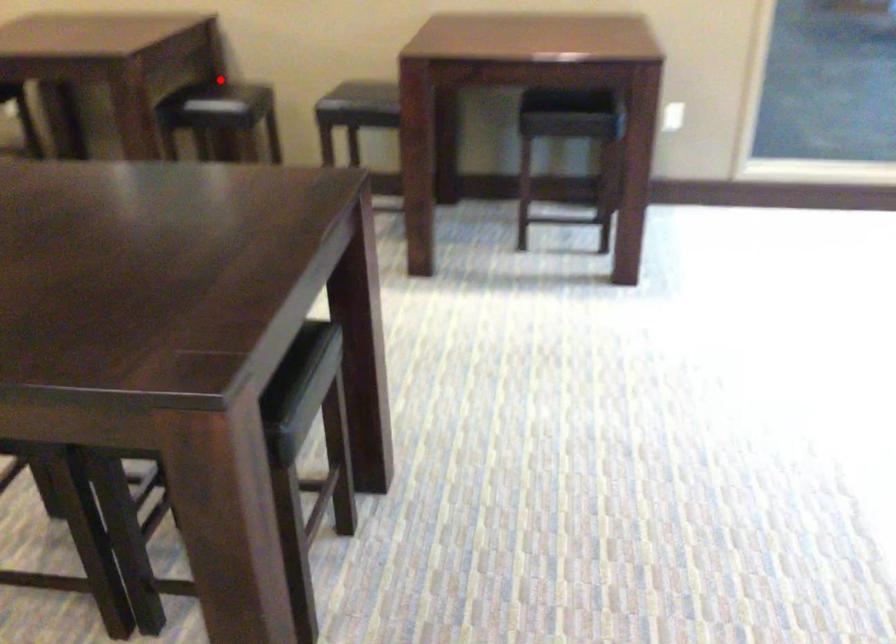
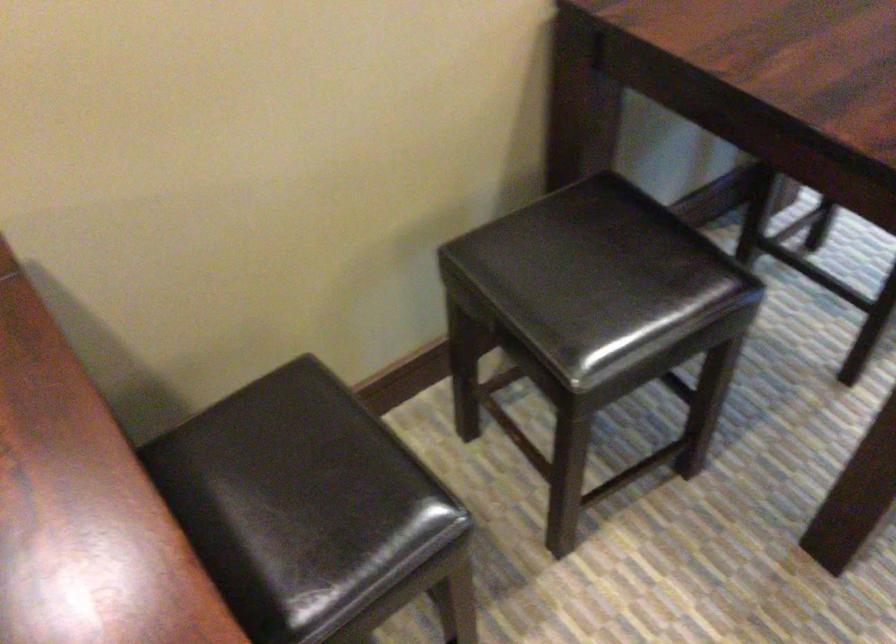
Question: I am providing you with two images of the same scene from different viewpoints. Given a red point in image1, look at the same physical point in image2. Is it:

Choices:
 (A) Closer to the viewpoint
 (B) Farther from the viewpoint

Answer: (A)